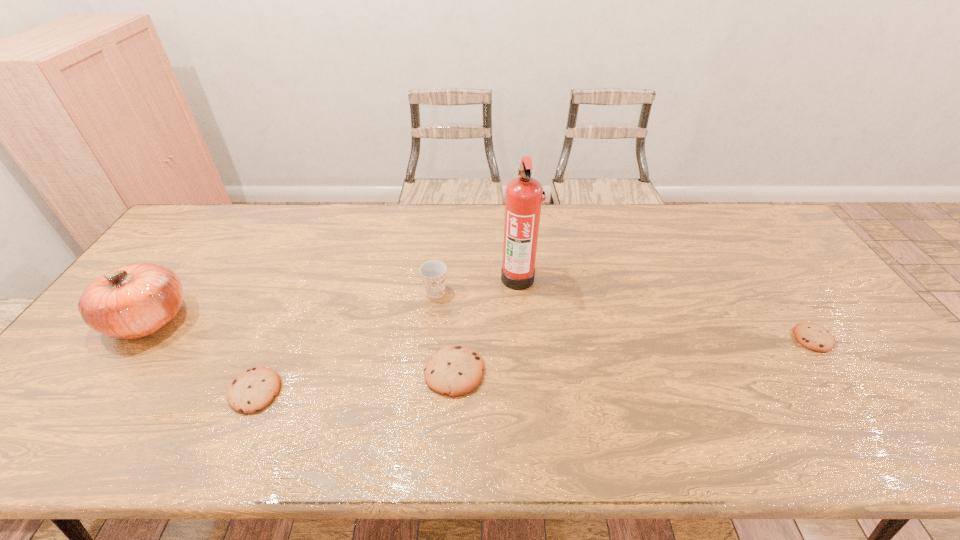
You are a GUI agent. You are given a task and a screenshot of the screen. Output one action in this format:
    pyautogui.click(x=<x>, y=<y>)
    Task: Click on the leftmost cookie
    Image resolution: width=960 pixels, height=540 pixels.
    Given the screenshot: What is the action you would take?
    pyautogui.click(x=254, y=389)

At what (x,y) coordinates should I click in order to perform the action: click on the fifth tallest object. Please return your answer as a coordinate pair (x, y). This screenshot has height=540, width=960. Looking at the image, I should click on (254, 389).

This screenshot has height=540, width=960. I want to click on the tallest cookie, so click(455, 370).

This screenshot has width=960, height=540. What are the coordinates of `the second cookie from right to left` in the screenshot? It's located at (455, 370).

This screenshot has width=960, height=540. In order to click on the shortest object in this screenshot , I will do 812,336.

I want to click on the shortest cookie, so click(x=812, y=336).

Where is `the fourth shortest object`? The image size is (960, 540). the fourth shortest object is located at coordinates (433, 272).

You are a GUI agent. You are given a task and a screenshot of the screen. Output one action in this format:
    pyautogui.click(x=<x>, y=<y>)
    Task: Click on the second tallest object
    This screenshot has width=960, height=540.
    Given the screenshot: What is the action you would take?
    pyautogui.click(x=132, y=301)

Identify the location of the leftmost object. This screenshot has width=960, height=540. click(132, 301).

The image size is (960, 540). Find the location of `the tallest object`. the tallest object is located at coordinates (523, 200).